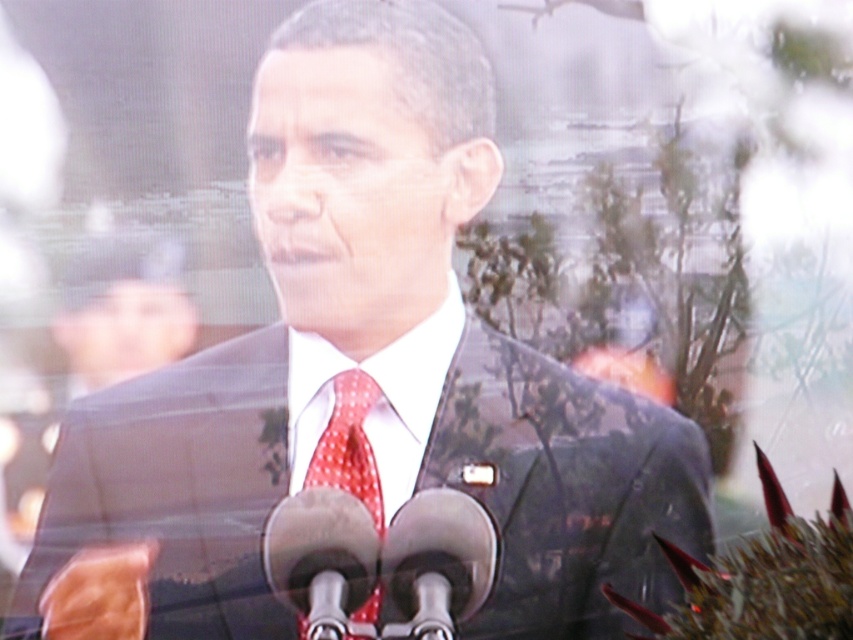
Does metallic silver microphone at center have a larger size compared to red dotted fabric tie at center?

Indeed, metallic silver microphone at center has a larger size compared to red dotted fabric tie at center.

Where is `metallic silver microphone at center`? metallic silver microphone at center is located at coordinates (380, 561).